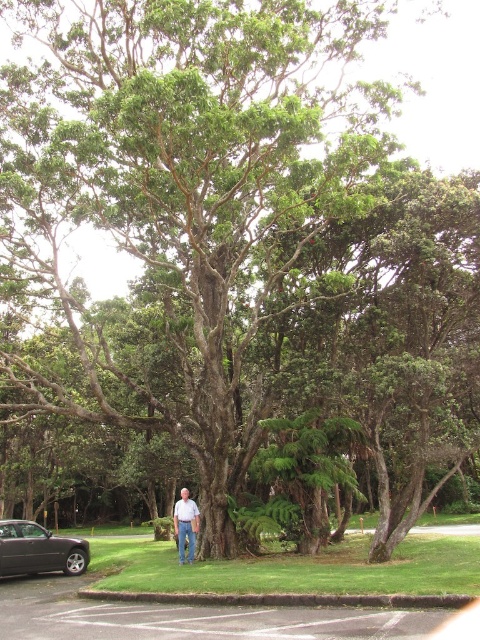
Question: Considering the relative positions of dark gray metallic car at lower left and white cotton shirt at center in the image provided, where is dark gray metallic car at lower left located with respect to white cotton shirt at center?

Choices:
 (A) below
 (B) above

Answer: (A)

Question: Which object is closer to the camera taking this photo?

Choices:
 (A) dark gray metallic car at lower left
 (B) white cotton shirt at center

Answer: (A)

Question: Is dark gray metallic car at lower left bigger than white cotton shirt at center?

Choices:
 (A) yes
 (B) no

Answer: (B)

Question: Which of the following is the closest to the observer?

Choices:
 (A) (178, 545)
 (B) (29, 541)

Answer: (B)

Question: Which object is farther from the camera taking this photo?

Choices:
 (A) white cotton shirt at center
 (B) dark gray metallic car at lower left

Answer: (A)

Question: Can you confirm if dark gray metallic car at lower left is positioned to the left of white cotton shirt at center?

Choices:
 (A) yes
 (B) no

Answer: (A)